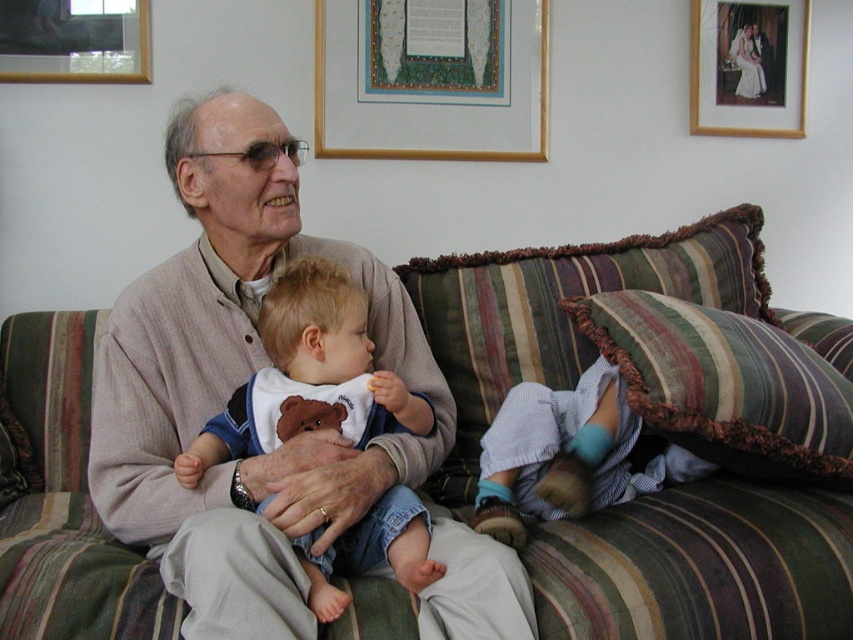
Based on the photo, you are a photographer trying to capture a candid shot of the scene. You notice the striped cotton pants at lower right and the wooden picture frame at upper right. Which object should you focus on first if you want to include both in your composition without changing your position?

You should focus on the striped cotton pants at lower right first because it is larger in size compared to the wooden picture frame at upper right, allowing you to frame both effectively in your shot.

You are a photographer standing at a certain distance from the striped fabric pillow at right. You want to take a closeup shot of the pillow without moving the camera. What adjustment should you make to your camera?

You should zoom in on the striped fabric pillow at right since it is 1.31 meters away from the camera, and zooming will allow you to capture a closer view without moving the camera closer.